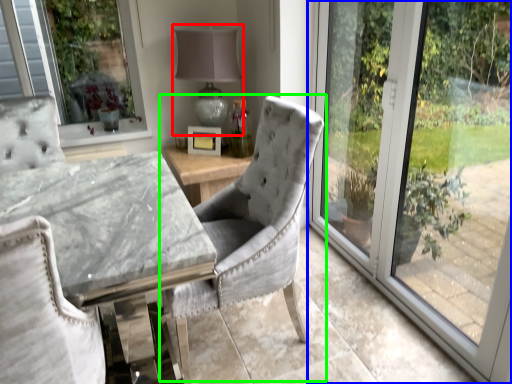
Question: Considering the real-world distances, which object is farthest from table lamp (highlighted by a red box)? window (highlighted by a blue box) or chair (highlighted by a green box)?

Choices:
 (A) window
 (B) chair

Answer: (B)